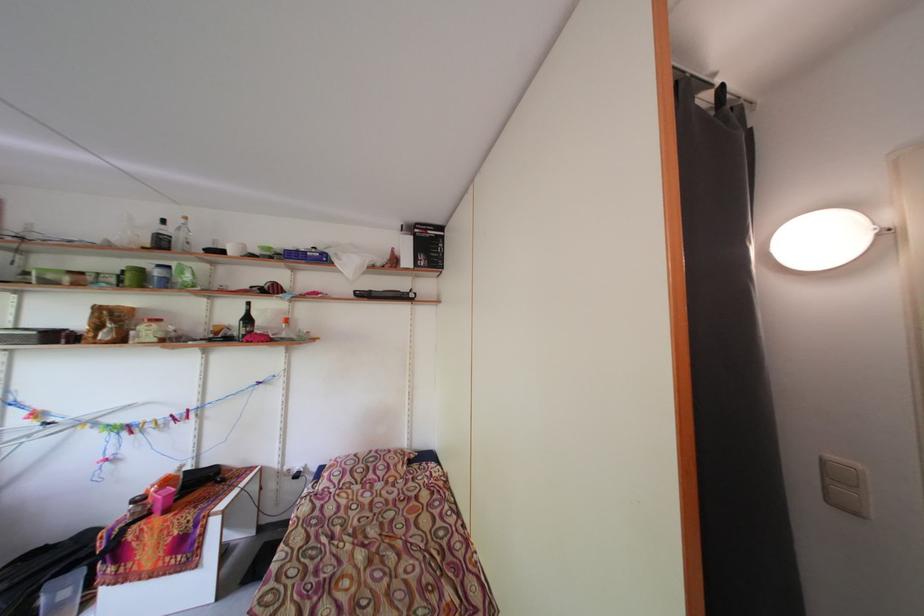
The image size is (924, 616). What are the coordinates of `pink plastic box` in the screenshot? It's located at (162, 500).